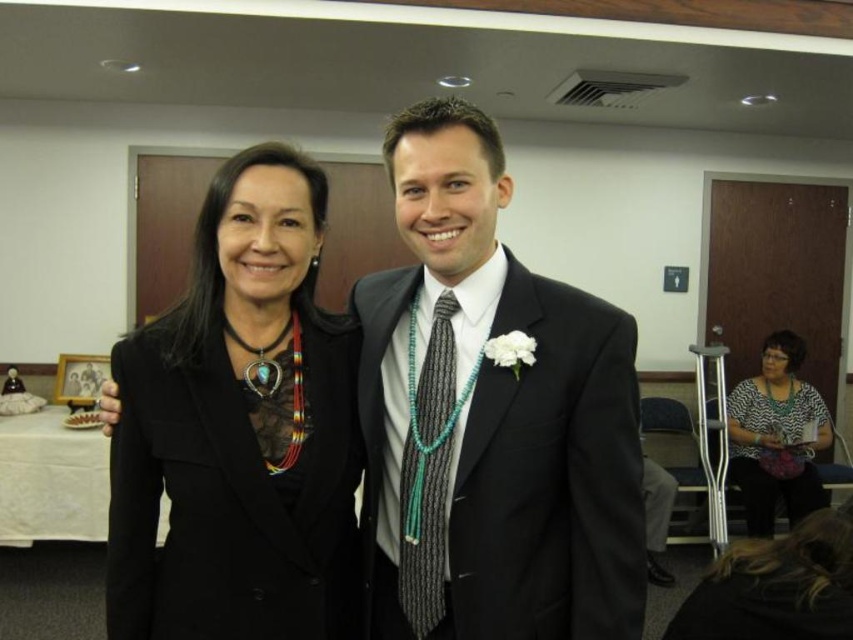
You are a photographer at a formal event. You need to adjust the lighting so that both the matte black suit at center and the printed fabric blouse at lower right are equally visible. Which object should you focus on first to ensure proper exposure?

The matte black suit at center is closer to the viewer than the printed fabric blouse at lower right. Since the black suit might absorb more light, focusing on it first will help balance the exposure so both appear visible.

You are at a formal event and need to locate the black leather jacket at left and the gray textured tie at center. From the perspective of someone facing the image, which item is positioned to the left?

The black leather jacket at left is to the left of the gray textured tie at center, so the black leather jacket at left is positioned to the left.